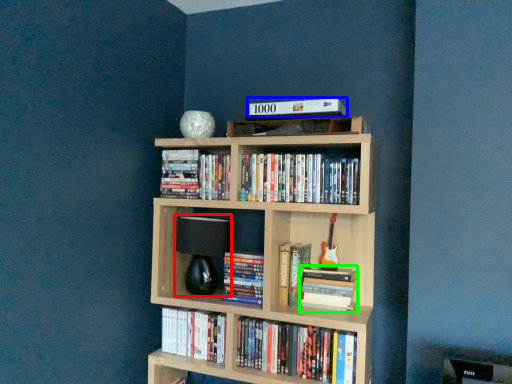
Question: Estimate the real-world distances between objects in this image. Which object is closer to lamp (highlighted by a red box), book (highlighted by a blue box) or book (highlighted by a green box)?

Choices:
 (A) book
 (B) book

Answer: (B)